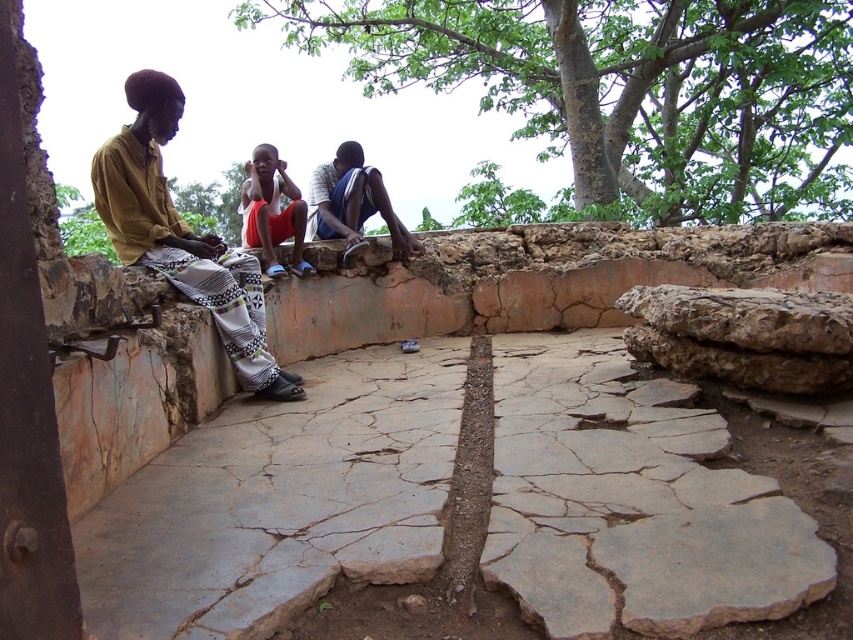
You are standing at the camera position and want to throw a ball to the point labeled as point (709, 220). If your throwing range is up to 10 meters, will you be able to reach that point?

The distance between the camera and point (709, 220) is 11.23 meters, which exceeds your throwing range of 10 meters. Therefore, you won not be able to reach that point.

You are a photographer trying to capture a candid shot of the two people sitting on the stone wall. You want to ensure both the yellow fabric pants at left and the orange cotton shorts at center are clearly visible in the frame. Based on their positions, which person should you focus on first to ensure both are in focus?

You should focus on the orange cotton shorts at center first because the yellow fabric pants at left is in front of it, so focusing on the orange cotton shorts at center will keep both in focus.

Based on the photo, you are standing at the base of the green leafy tree at upper center in the image. You want to place a small garden ornament exactly at the point labeled as point [627,88]. Is this point located on the tree itself or somewhere else?

The point [627,88] is on the green leafy tree at upper center, so the ornament will be placed directly on the tree.